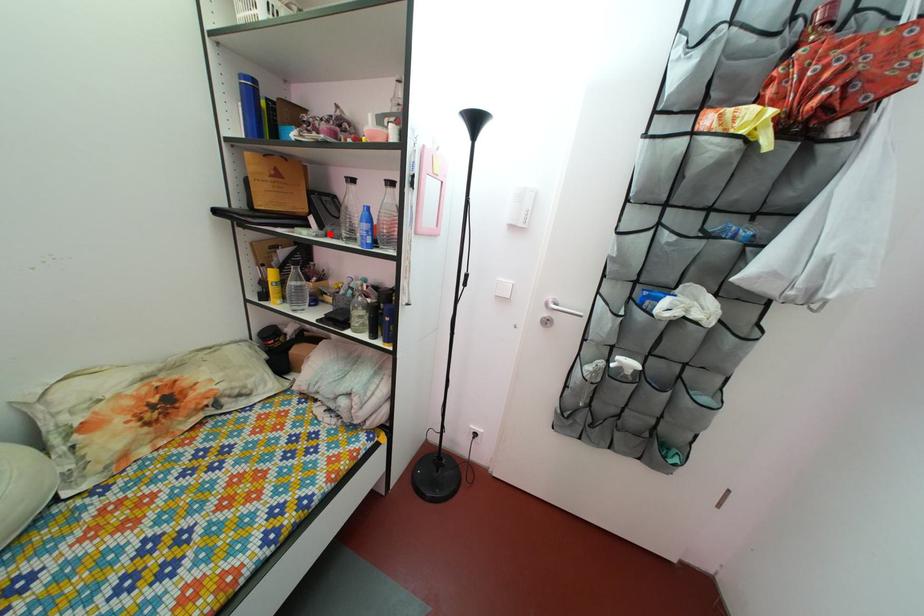
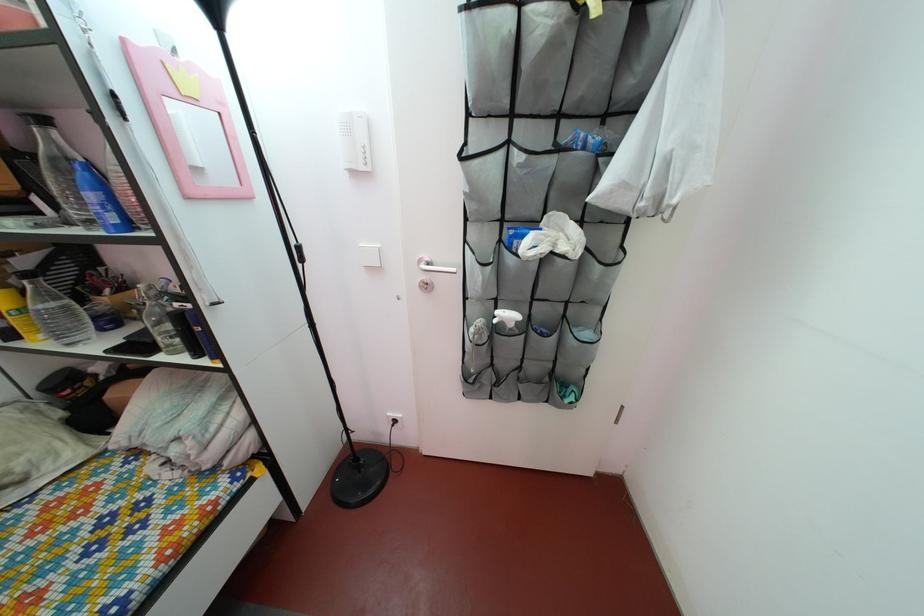
In the second image, find the point that corresponds to the highlighted location in the first image.

(68, 217)